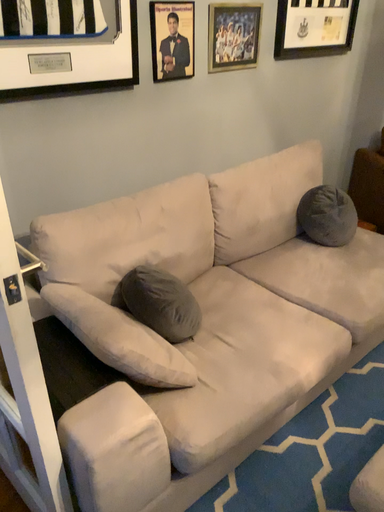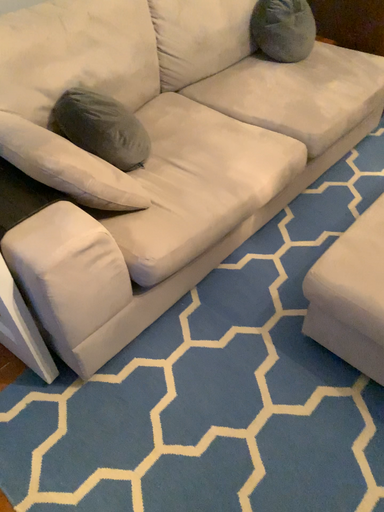
Question: Which way did the camera rotate in the video?

Choices:
 (A) rotated upward
 (B) rotated downward

Answer: (B)